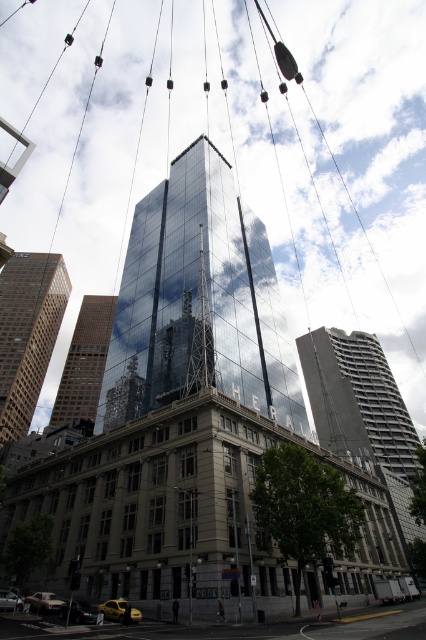
Which of these two, smooth glass building at center or brown glass skyscraper at left, stands shorter?

With less height is smooth glass building at center.

Does smooth glass building at center appear on the left side of brown glass skyscraper at left?

No, smooth glass building at center is not to the left of brown glass skyscraper at left.

Locate an element on the screen. This screenshot has width=426, height=640. smooth glass building at center is located at coordinates (356, 400).

Find the location of a particular element. The image size is (426, 640). smooth glass building at center is located at coordinates (356, 400).

Consider the image. Who is more distant from viewer, (199, 161) or (92, 396)?

The point (92, 396) is behind.

Between reflective glass tower at center and glassy reflective skyscraper at center, which one has less height?

Standing shorter between the two is reflective glass tower at center.

You are a GUI agent. You are given a task and a screenshot of the screen. Output one action in this format:
    pyautogui.click(x=<x>, y=<y>)
    Task: Click on the reflective glass tower at center
    This screenshot has width=426, height=640.
    Given the screenshot: What is the action you would take?
    pyautogui.click(x=198, y=301)

Where is `reflective glass tower at center`? The height and width of the screenshot is (640, 426). reflective glass tower at center is located at coordinates (198, 301).

Which is behind, point (192, 278) or point (46, 292)?

Point (46, 292)

Can you confirm if reflective glass tower at center is positioned above brown glass skyscraper at left?

Yes.

Which is behind, point (141, 353) or point (25, 252)?

Positioned behind is point (25, 252).

This screenshot has width=426, height=640. In order to click on reflective glass tower at center in this screenshot , I will do `click(198, 301)`.